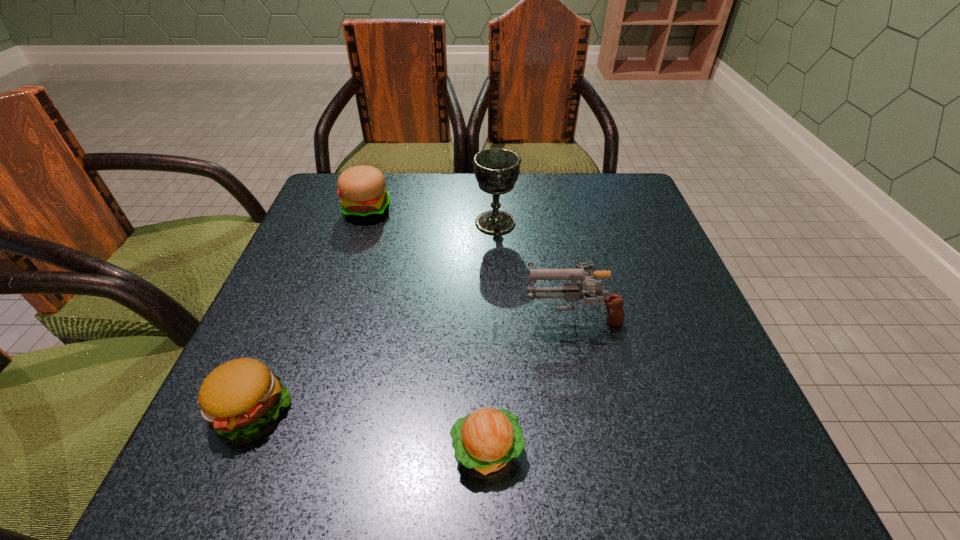
The height and width of the screenshot is (540, 960). What are the coordinates of `hamburger that is the second closest to the third farthest object` in the screenshot? It's located at (237, 398).

The width and height of the screenshot is (960, 540). Find the location of `hamburger identified as the second closest to the rightmost hamburger`. hamburger identified as the second closest to the rightmost hamburger is located at coordinates [x=362, y=189].